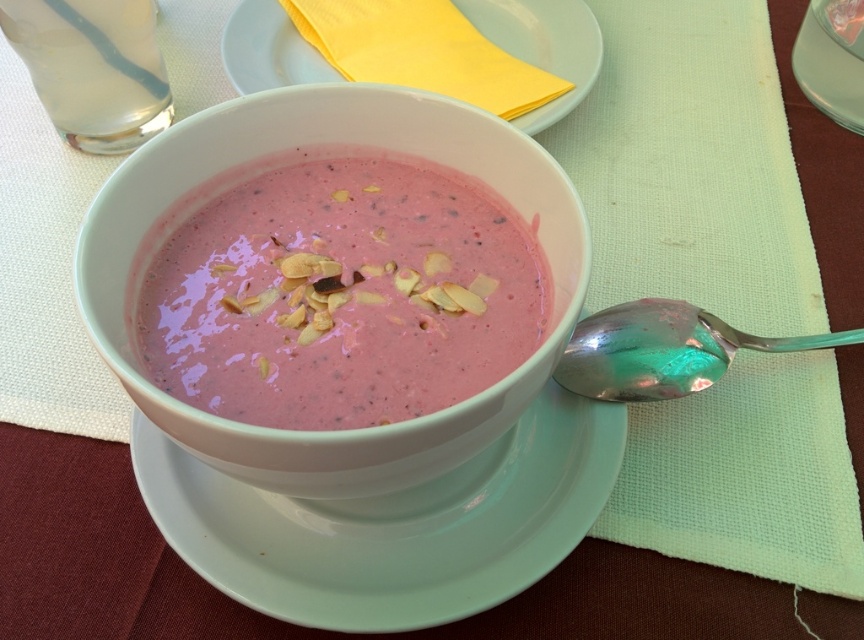
You are a chef preparing to serve a dish. You have a matte ceramic bowl at center and a silver metallic spoon at lower right. Which item is taller?

The matte ceramic bowl at center is taller than the silver metallic spoon at lower right according to the description.

You are a food stylist arranging a photo shoot. You need to stack the matte ceramic bowl at center and the white ceramic plate at upper center vertically. Which one should you place on top to ensure stability?

The matte ceramic bowl at center is thinner than the white ceramic plate at upper center, so placing the bowl on top of the plate would provide better stability due to the plate having a wider base.

You are sitting at the table and want to reach for an item. There are two points marked on the table surface. One is at point (x=283, y=112) and the other is at point (x=599, y=392). Which point is closer to you?

Point (x=283, y=112) is closer to the viewer than point (x=599, y=392).